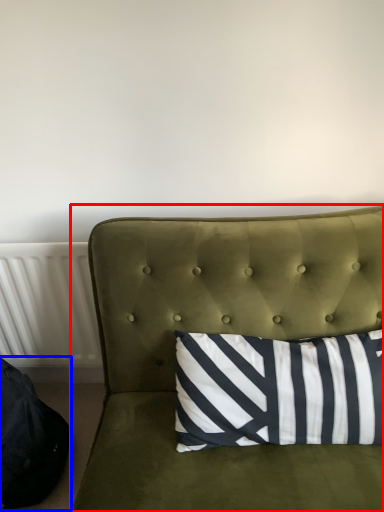
Question: Which object is closer to the camera taking this photo, studio couch (highlighted by a red box) or bean bag chair (highlighted by a blue box)?

Choices:
 (A) studio couch
 (B) bean bag chair

Answer: (A)